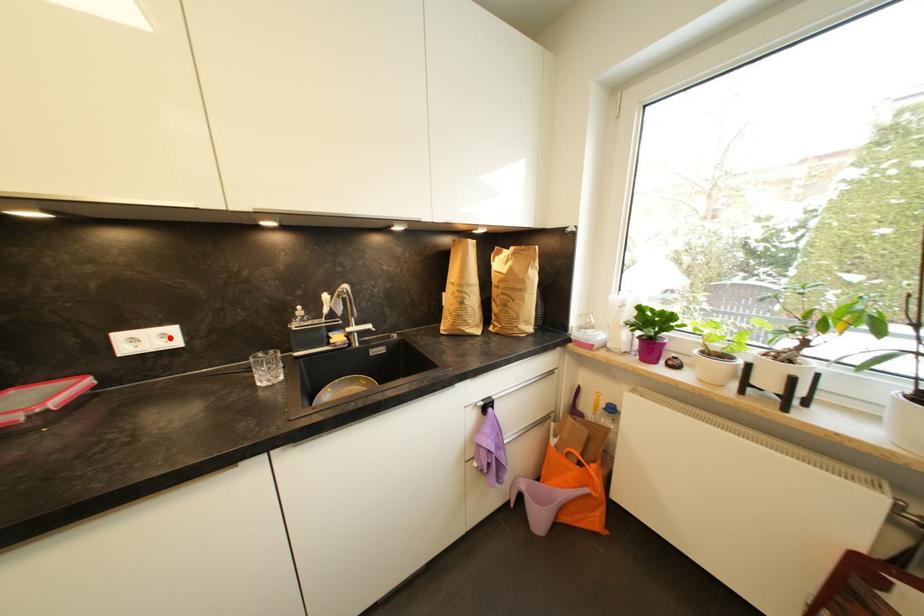
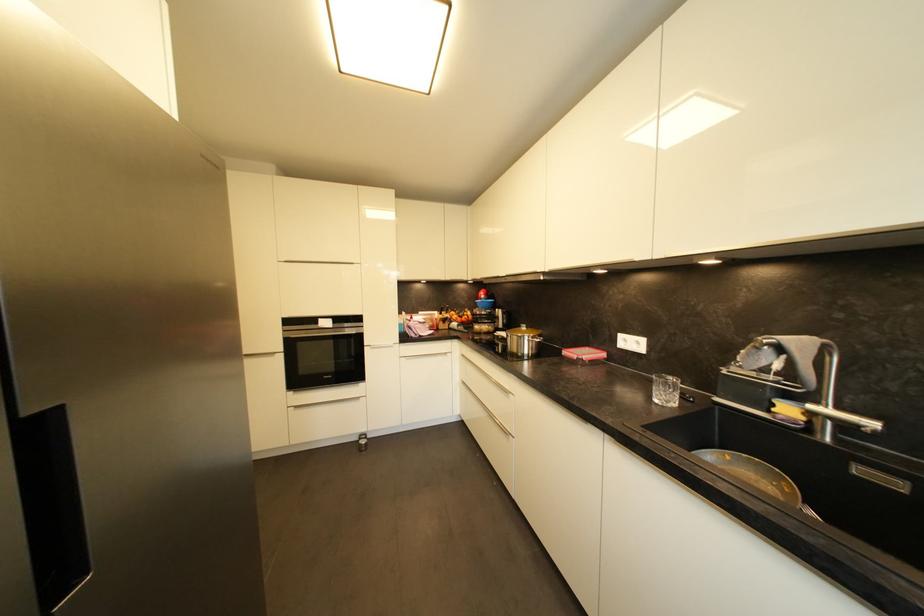
Where in the second image is the point corresponding to the highlighted location from the first image?

(642, 345)